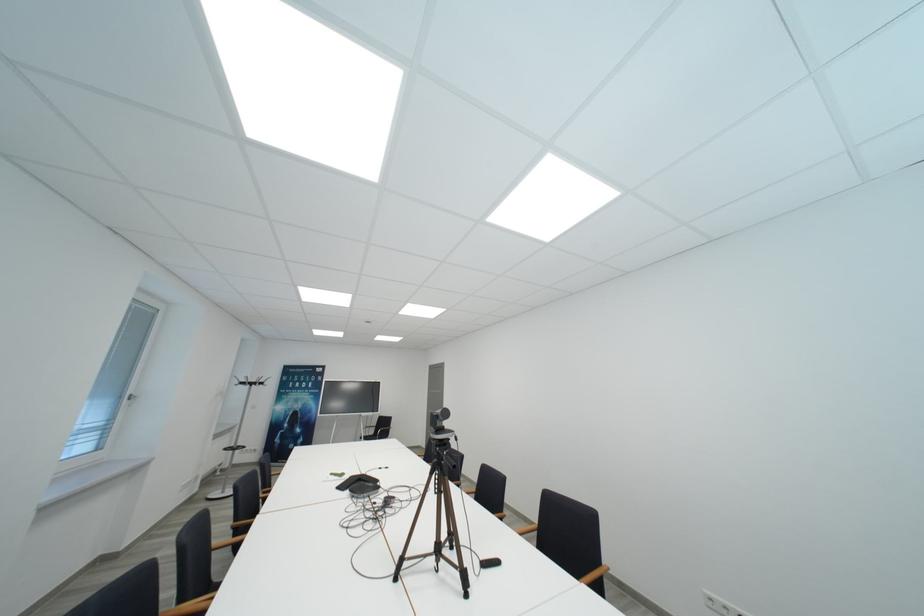
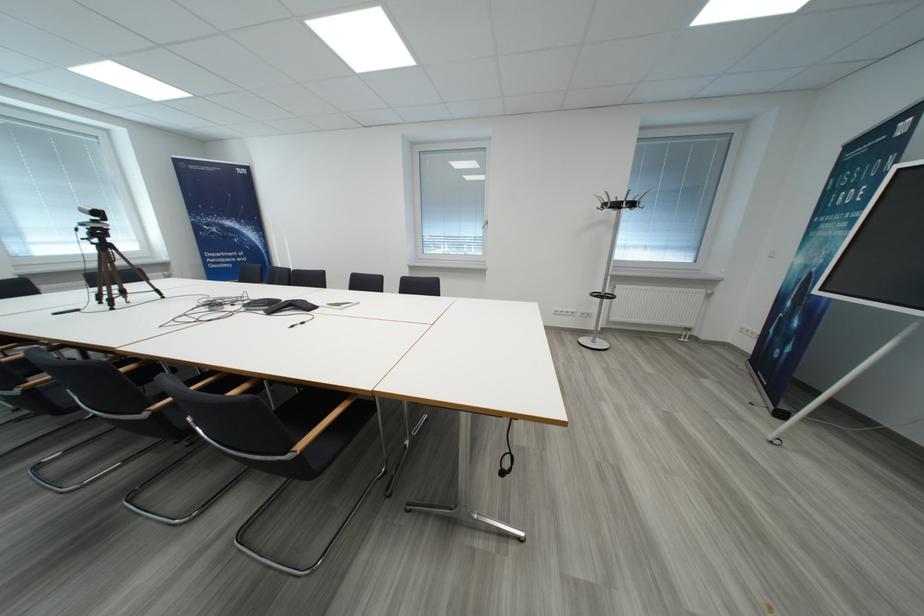
Where in the second image is the point corresponding to [270,387] from the first image?

(623, 208)